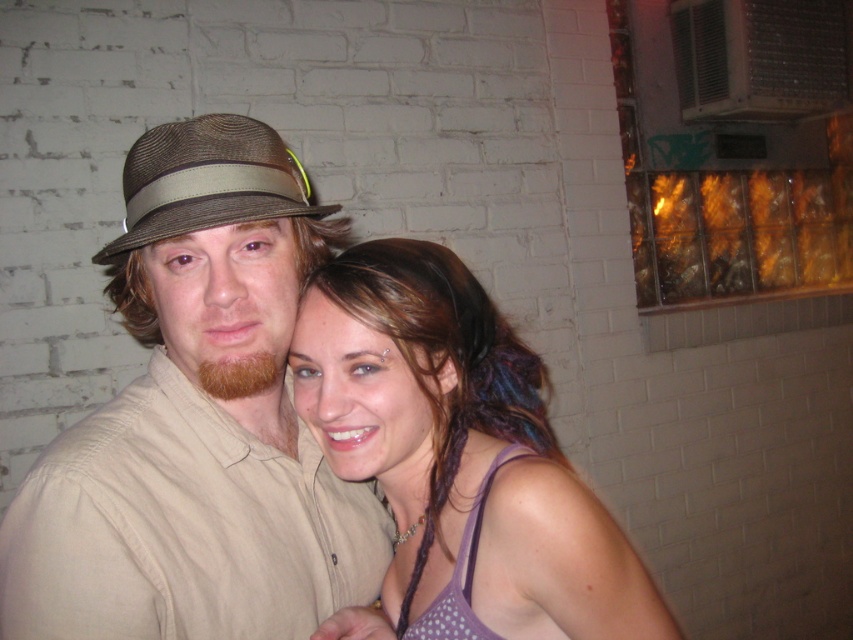
You are holding a 30 inch ladder and need to reach a point marked at point (120, 417). Can you reach it with your ladder?

The distance between you and the point (120, 417) is 33.44 inches, so the ladder is 30 inches too short to reach it.

You are an interior designer who wants to place a decorative item exactly at the position of the purple dotted tank top at center. What are the coordinates where you should place it?

The coordinates for the purple dotted tank top at center are at point (457, 460).

You are a photographer setting up for a portrait. You have two hats, the matte brown hat at center and the brown woven hat at left, placed on a table. The distance between them is crucial for the composition. If your camera can focus on objects within 5 inches, will both hats be in focus?

The matte brown hat at center is 5.06 inches from the brown woven hat at left. Since the distance between them is slightly over 5 inches, the camera might struggle to keep both in focus simultaneously.